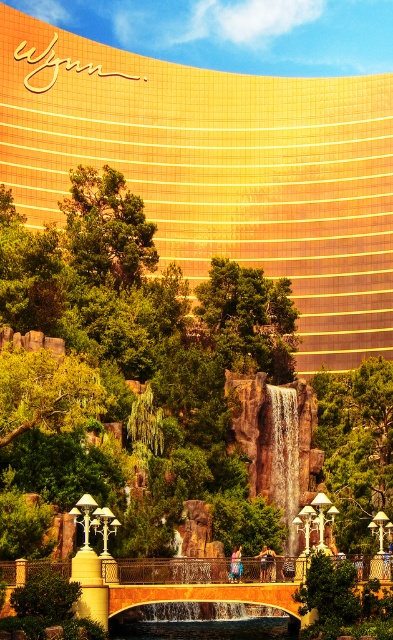
You are standing in front of the Wynn Las Vegas hotel and want to take a photo that includes both the golden facade and the waterfall. You notice two points marked on your map at coordinates point [315,316] and point [286,456]. Which point should you stand closer to in order to ensure both the hotel facade and the waterfall are in frame?

You should stand closer to point [315,316] because it is closer to you than point [286,456], allowing both the Wynn Las Vegas hotel facade and the waterfall to be captured in the photo.

You are a drone operator planning to fly a drone from the gold metallic building at upper center to the golden metallic waterfall at center. Considering their heights, which object should you start your descent from?

The gold metallic building at upper center is taller than the golden metallic waterfall at center, so you should start your descent from the gold metallic building at upper center.